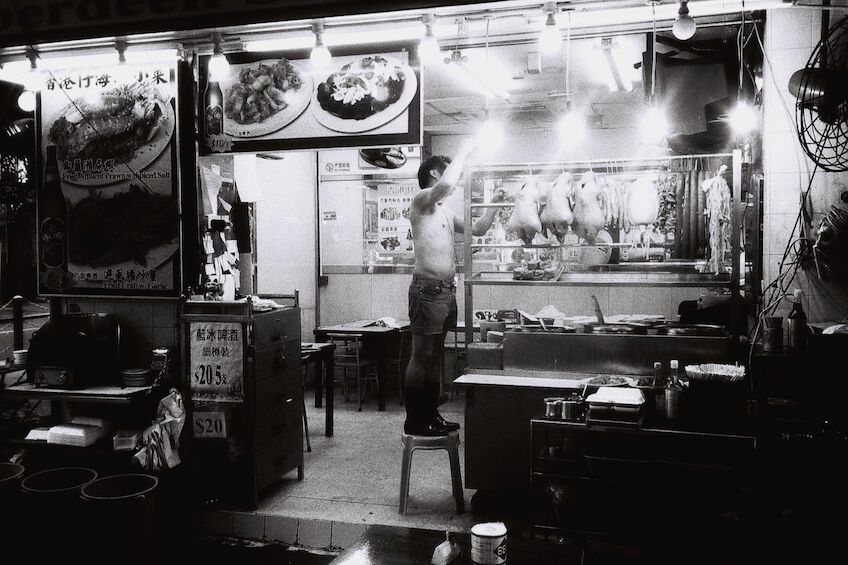
Locate an element on the screen. The width and height of the screenshot is (848, 565). tables is located at coordinates (319, 347), (358, 330), (388, 547), (460, 325).